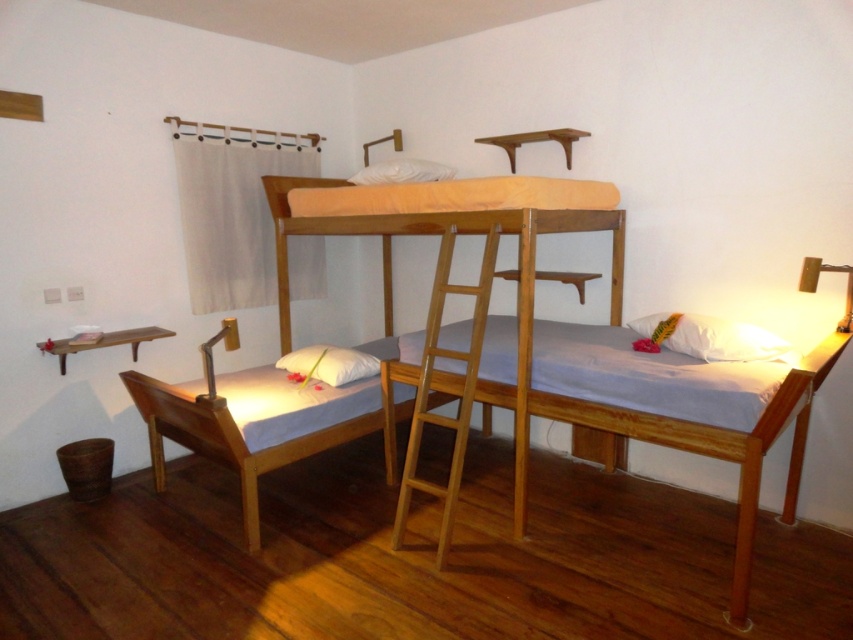
Question: Estimate the real-world distances between objects in this image. Which object is farther from the matte white lamp at right?

Choices:
 (A) light wood ladder at center
 (B) white soft pillow at lower left

Answer: (B)

Question: Does light brown wooden bed at center have a greater width compared to matte white lamp at right?

Choices:
 (A) yes
 (B) no

Answer: (A)

Question: Does white soft pillow at lower right come behind white soft pillow at upper center?

Choices:
 (A) yes
 (B) no

Answer: (B)

Question: Which point is farther to the camera?

Choices:
 (A) (148, 326)
 (B) (438, 166)
 (C) (305, 365)

Answer: (A)

Question: Which point is farther to the camera?

Choices:
 (A) light wood ladder at center
 (B) white soft pillow at lower right
 (C) wooden shelf at lower left
 (D) matte white lamp at right

Answer: (C)

Question: Does light wood ladder at center lie behind matte white lamp at right?

Choices:
 (A) no
 (B) yes

Answer: (B)